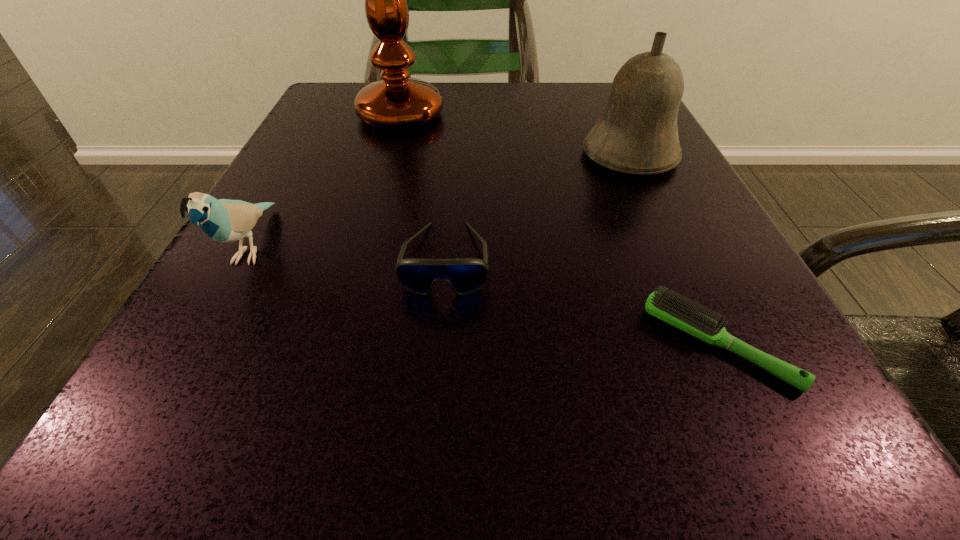
Locate an element on the screen. empty location between the table lamp and the shortest object is located at coordinates (560, 229).

Where is `free spot between the third shortest object and the bell`? The height and width of the screenshot is (540, 960). free spot between the third shortest object and the bell is located at coordinates (442, 201).

At what (x,y) coordinates should I click in order to perform the action: click on free space between the sunglasses and the tallest object. Please return your answer as a coordinate pair (x, y). The image size is (960, 540). Looking at the image, I should click on [423, 187].

Where is `free point between the bell and the hairbrush`? This screenshot has height=540, width=960. free point between the bell and the hairbrush is located at coordinates (674, 249).

You are a GUI agent. You are given a task and a screenshot of the screen. Output one action in this format:
    pyautogui.click(x=<x>, y=<y>)
    Task: Click on the object that is the fourth nearest to the fourth shortest object
    
    Given the screenshot: What is the action you would take?
    pyautogui.click(x=223, y=220)

Select which object is the third closest to the sunglasses. Please provide its 2D coordinates. Your answer should be formatted as a tuple, i.e. [(x, y)], where the tuple contains the x and y coordinates of a point satisfying the conditions above.

[(637, 133)]